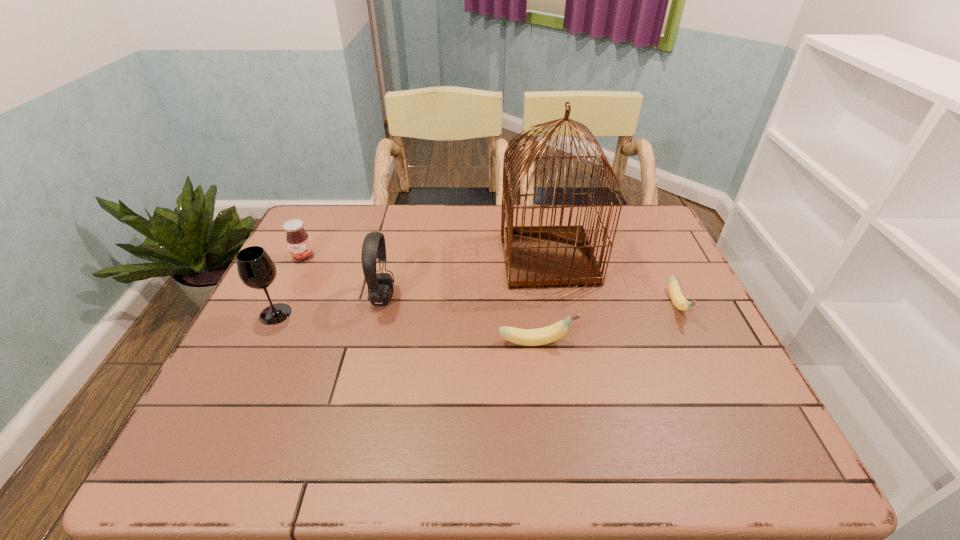
Given the evenly spaced bananas in the image, where should an extra banana be added on the left to preserve the spacing? Please point to a vacant space. Please provide its 2D coordinates. Your answer should be formatted as a tuple, i.e. [(x, y)], where the tuple contains the x and y coordinates of a point satisfying the conditions above.

[(369, 386)]